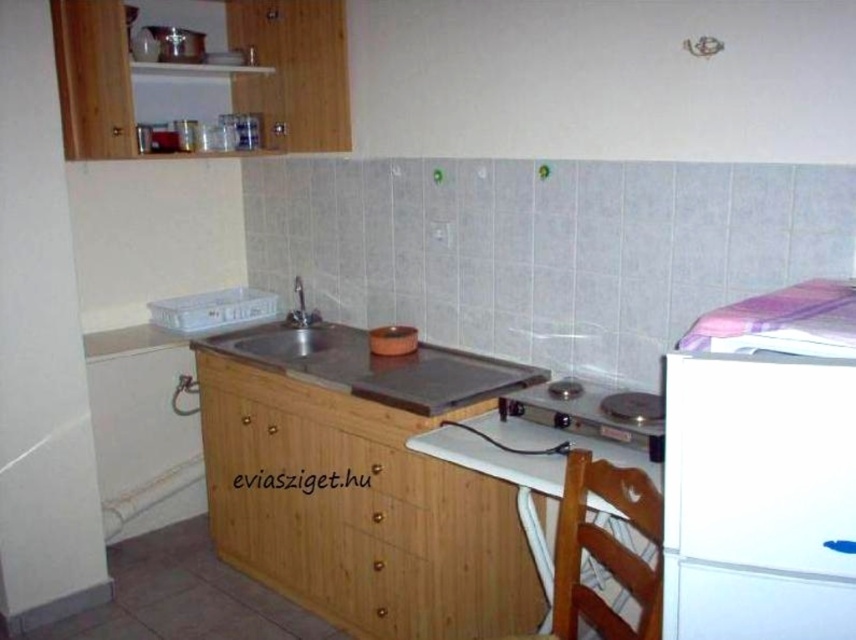
Consider the image. Which is below, white matte refrigerator at right or metallic gray stove at center?

metallic gray stove at center

Between white matte refrigerator at right and metallic gray stove at center, which one is positioned higher?

white matte refrigerator at right is higher up.

Locate an element on the screen. white matte refrigerator at right is located at coordinates (758, 497).

What are the coordinates of `white matte refrigerator at right` in the screenshot? It's located at (758, 497).

Does metallic sink at center have a smaller size compared to metallic gray stove at center?

No.

Image resolution: width=856 pixels, height=640 pixels. What do you see at coordinates (294, 340) in the screenshot?
I see `metallic sink at center` at bounding box center [294, 340].

Which is behind, point (278, 333) or point (599, 403)?

Point (278, 333)

Find the location of `metallic sink at center`. metallic sink at center is located at coordinates (294, 340).

Is white matte refrigerator at right above wooden chair at lower right?

Indeed, white matte refrigerator at right is positioned over wooden chair at lower right.

Which is in front, point (824, 413) or point (616, 481)?

Point (824, 413) is in front.

Identify the location of white matte refrigerator at right. Image resolution: width=856 pixels, height=640 pixels. (758, 497).